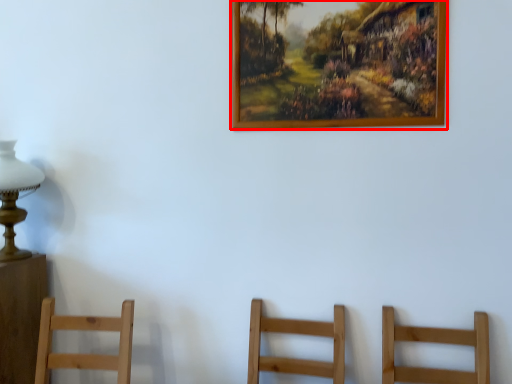
Question: From the image's perspective, what is the correct spatial positioning of picture frame (annotated by the red box) in reference to table lamp?

Choices:
 (A) above
 (B) below

Answer: (A)